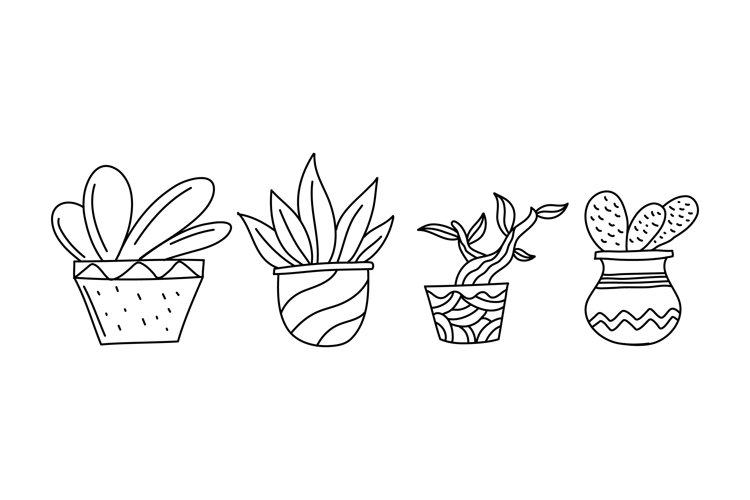
Locate an element on the screen. empty space above first vase is located at coordinates (152, 131).